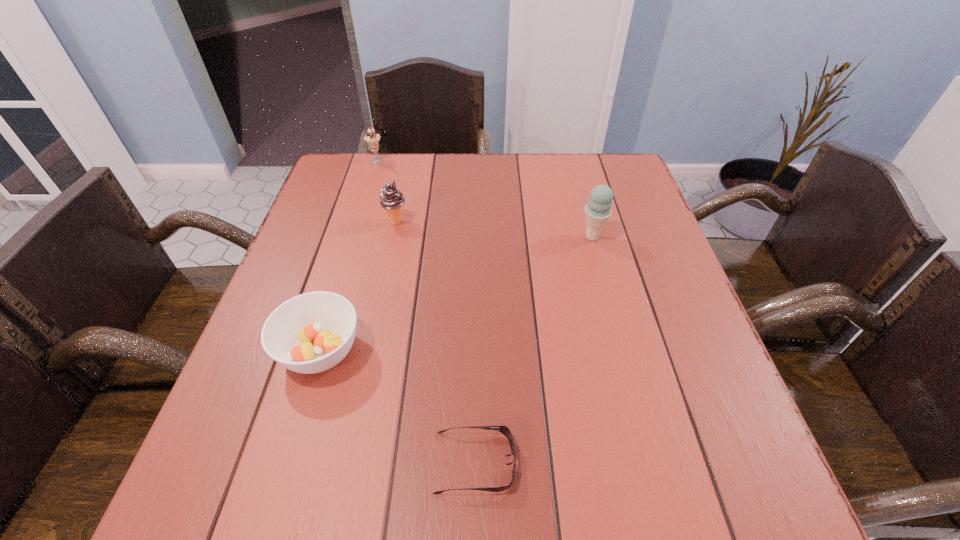
Identify the location of free space at the near edge. (402, 500).

I want to click on vacant space at the left edge, so click(x=318, y=270).

Find the location of a particular element. vacant space at the right edge of the desktop is located at coordinates (634, 279).

This screenshot has width=960, height=540. What are the coordinates of `free space at the far left corner of the desktop` in the screenshot? It's located at (357, 190).

At what (x,y) coordinates should I click in order to perform the action: click on vacant space at the near left corner of the desktop. Please return your answer as a coordinate pair (x, y). Looking at the image, I should click on (209, 470).

What are the coordinates of `vacant space at the far right corner of the desktop` in the screenshot? It's located at (628, 190).

Identify the location of free space between the fourth tallest object and the farthest object. (348, 256).

The image size is (960, 540). I want to click on vacant point located between the second shortest object and the farthest icecream, so click(348, 256).

The image size is (960, 540). Find the location of `free space between the fourth tallest object and the farthest object`. free space between the fourth tallest object and the farthest object is located at coordinates (348, 256).

I want to click on vacant area that lies between the soup bowl and the sunglasses, so click(397, 407).